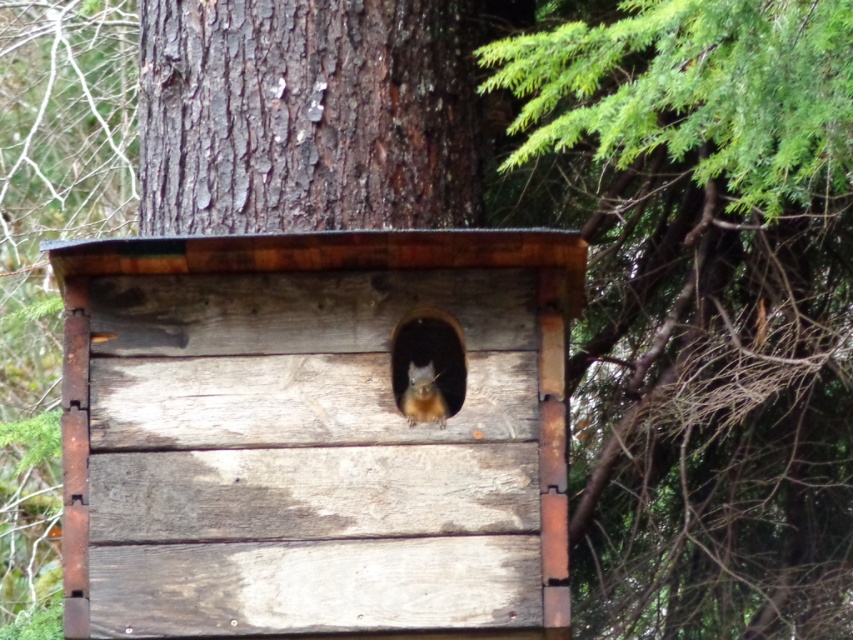
You are a small animal trying to enter the smooth wood hole at center. There is an orange fur squirrel at center already inside. Can you fit through the hole if you are the same size as the squirrel?

The smooth wood hole at center might be wider than orange fur squirrel at center, so if you are the same size as the squirrel, you might be able to fit through the hole.

In the scene shown: You are standing in the forest looking at the wooden birdhouse. There are two points marked on the birdhouse. Which point, point (502, 410) or point (669, 515), is closer to you?

Point (502, 410) is closer to the viewer than point (669, 515).